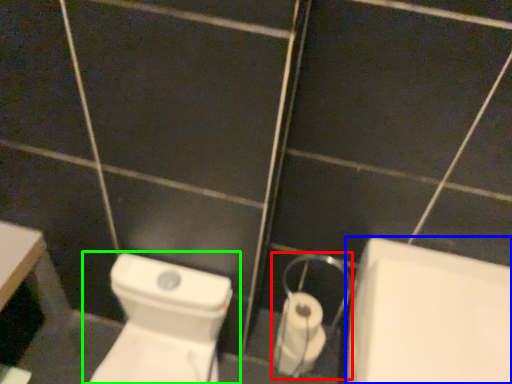
Question: Estimate the real-world distances between objects in this image. Which object is closer to dispenser (highlighted by a red box), bath (highlighted by a blue box) or toilet (highlighted by a green box)?

Choices:
 (A) bath
 (B) toilet

Answer: (A)